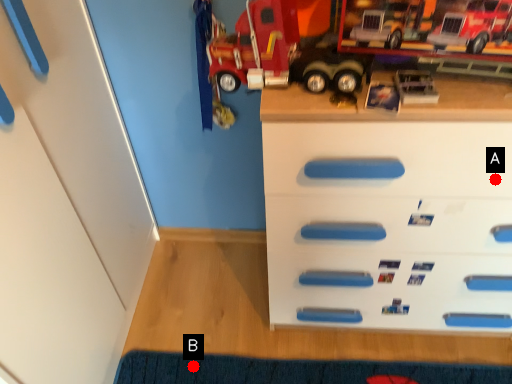
Question: Two points are circled on the image, labeled by A and B beside each circle. Which point appears farthest from the camera in this image?

Choices:
 (A) A is further
 (B) B is further

Answer: (B)